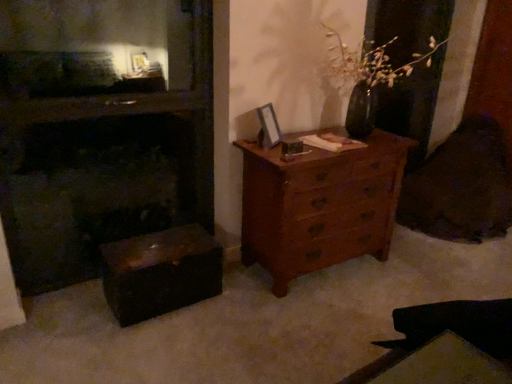
The image size is (512, 384). In order to click on vacant area on top of shiny dark wood trunk at lower left (from a real-world perspective) in this screenshot , I will do `click(154, 248)`.